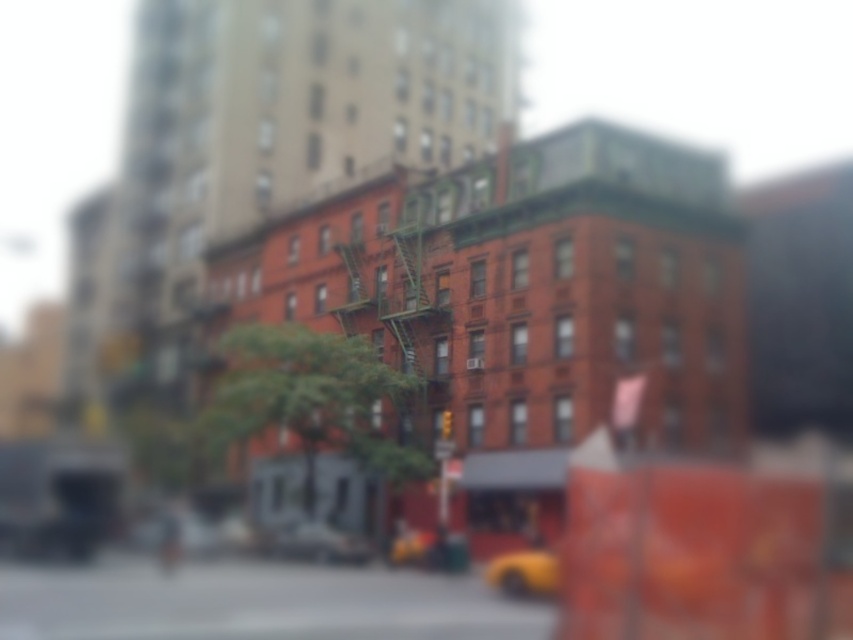
Between point (322, 552) and point (495, 561), which one is positioned in front?

Positioned in front is point (495, 561).

Where is `yellow matte car at center`? Image resolution: width=853 pixels, height=640 pixels. yellow matte car at center is located at coordinates (318, 544).